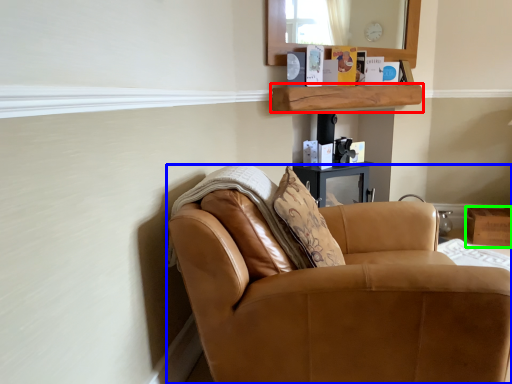
Question: Estimate the real-world distances between objects in this image. Which object is farther from shelf (highlighted by a red box), chair (highlighted by a blue box) or box (highlighted by a green box)?

Choices:
 (A) chair
 (B) box

Answer: (A)